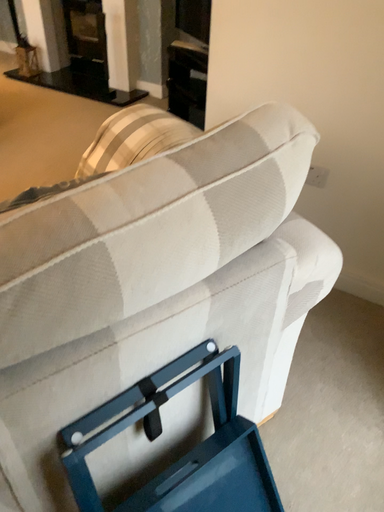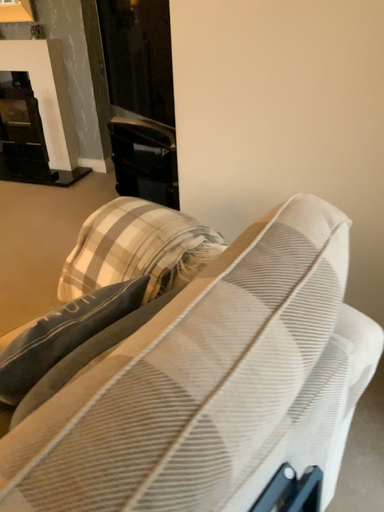
Question: Which way did the camera rotate in the video?

Choices:
 (A) rotated left
 (B) rotated right

Answer: (B)